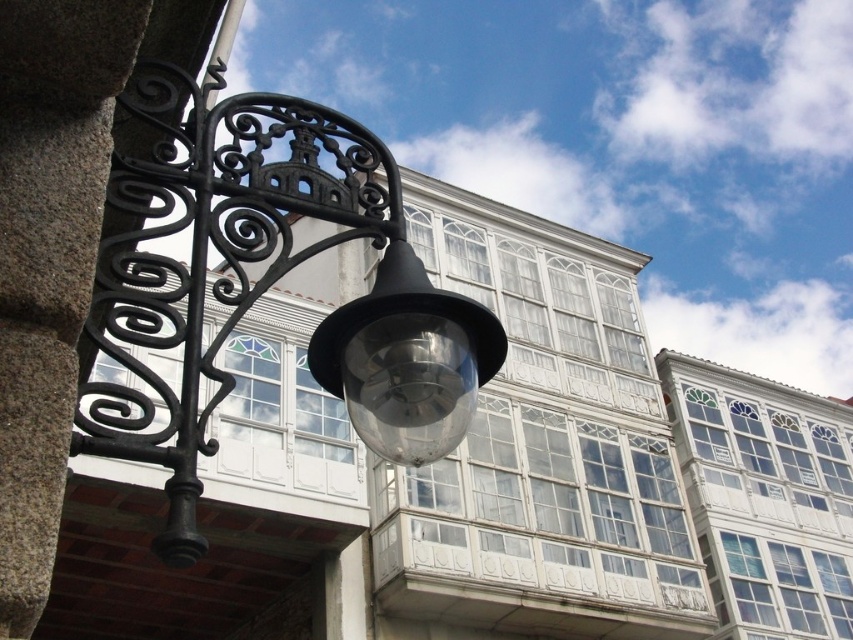
You are standing in front of the traditional European building and notice a transparent glass light fixture at center. Can you confirm if this light fixture is located exactly at the point with coordinates [407,360]?

Yes, the transparent glass light fixture at center is located exactly at the point with coordinates [407,360].

You are an architect analyzing the spatial arrangement of the scene. Which object, the matte black lamp at left or the transparent glass light fixture at center, is closer to the viewer?

The matte black lamp at left is closer to the viewer because it is positioned in front of the transparent glass light fixture at center.